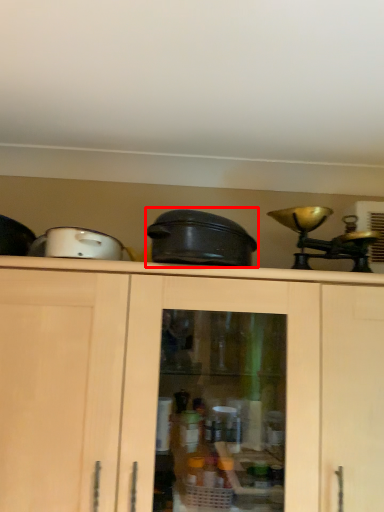
Question: Considering the relative positions of crock pot (annotated by the red box) and appliance in the image provided, where is crock pot (annotated by the red box) located with respect to the staircase?

Choices:
 (A) right
 (B) left

Answer: (A)